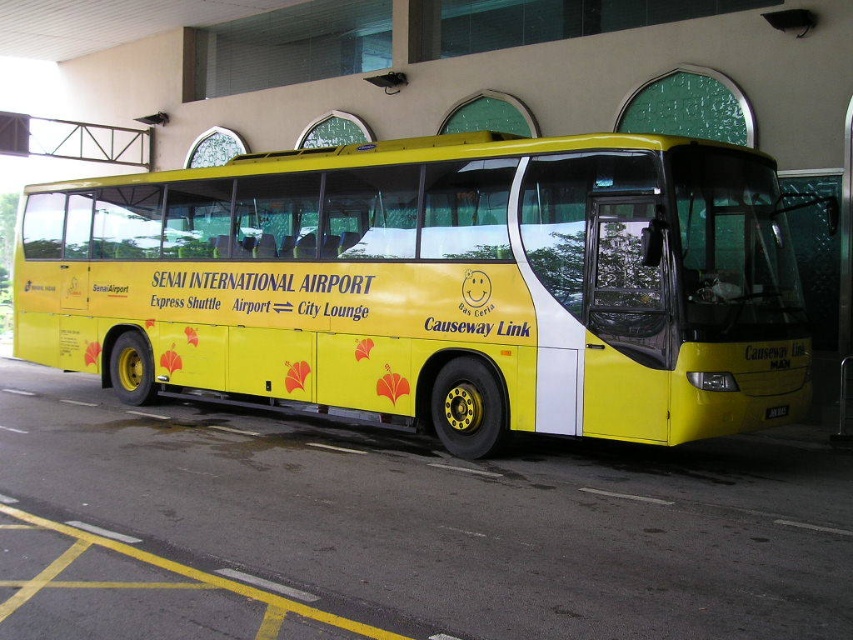
You are a delivery person with a cart that is 2 meters wide. You need to move from the yellow asphalt at lower center to the yellow matte bus at center. Is there enough space for your cart to pass between them?

The yellow matte bus at center and yellow asphalt at lower center are 2.21 meters apart. Since your cart is 2 meters wide, there is enough space for it to pass between them as the distance is greater than the cart width.

You are a delivery person who needs to park your van in the parking lot behind the yellow matte bus at center. The parking lot is paved with yellow asphalt at lower center. Can you safely park your van behind the bus without blocking the asphalt area?

The yellow matte bus at center is positioned over yellow asphalt at lower center, so parking behind the bus may block part of the asphalt area. Ensure there is enough space behind the bus to park without obstructing the paved area.

You are a delivery person who needs to load a package onto a truck that is 2 meters tall. You see the yellow matte bus at center and the yellow asphalt at lower center. Which object is taller and can accommodate the package?

The yellow matte bus at center is taller than the yellow asphalt at lower center. Since the truck requires a height of 2 meters, the yellow matte bus at center is the appropriate choice as it meets the height requirement.